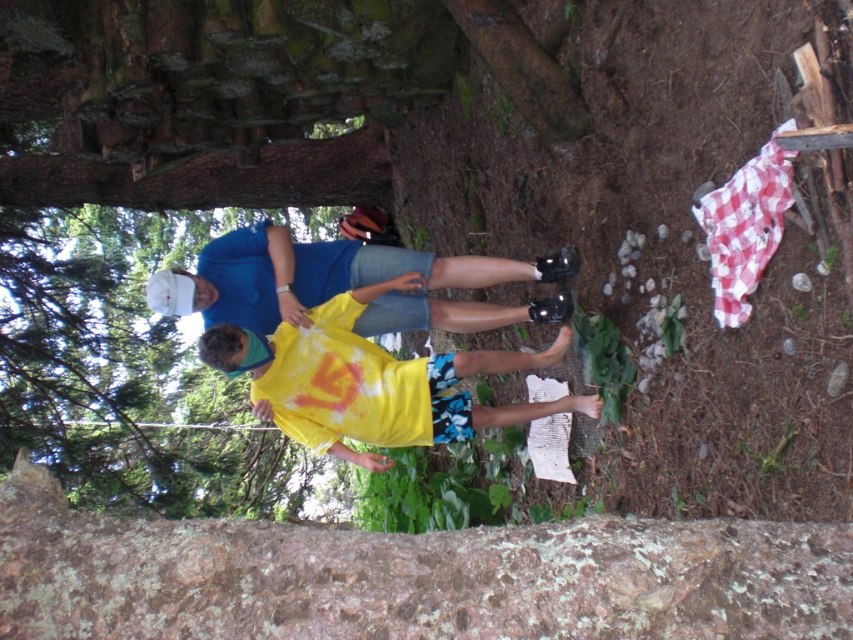
Question: Can you confirm if yellow tie-dye t-shirt at center is positioned to the left of matte blue shirt at center?

Choices:
 (A) yes
 (B) no

Answer: (B)

Question: Is yellow tie-dye t-shirt at center smaller than matte blue shirt at center?

Choices:
 (A) yes
 (B) no

Answer: (B)

Question: Does yellow tie-dye t-shirt at center have a smaller size compared to matte blue shirt at center?

Choices:
 (A) yes
 (B) no

Answer: (B)

Question: Which point is farther to the camera?

Choices:
 (A) (531, 413)
 (B) (428, 308)

Answer: (B)

Question: Among these points, which one is nearest to the camera?

Choices:
 (A) (502, 416)
 (B) (234, 237)

Answer: (B)